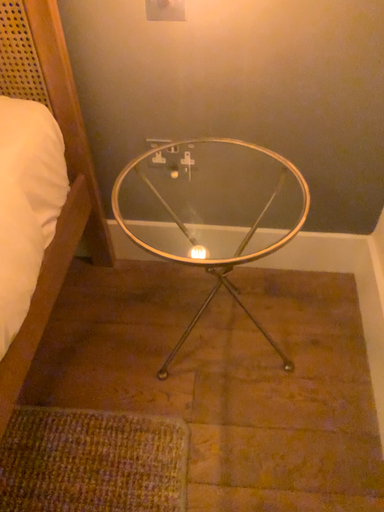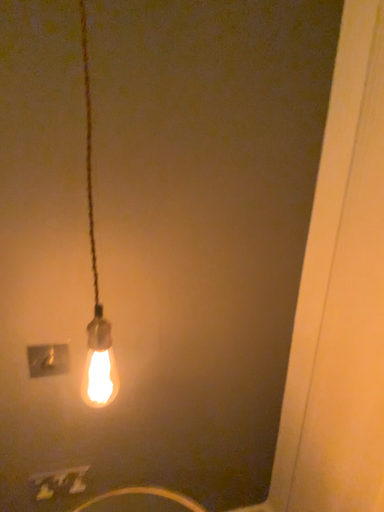
Question: Which way did the camera rotate in the video?

Choices:
 (A) rotated left
 (B) rotated right

Answer: (B)